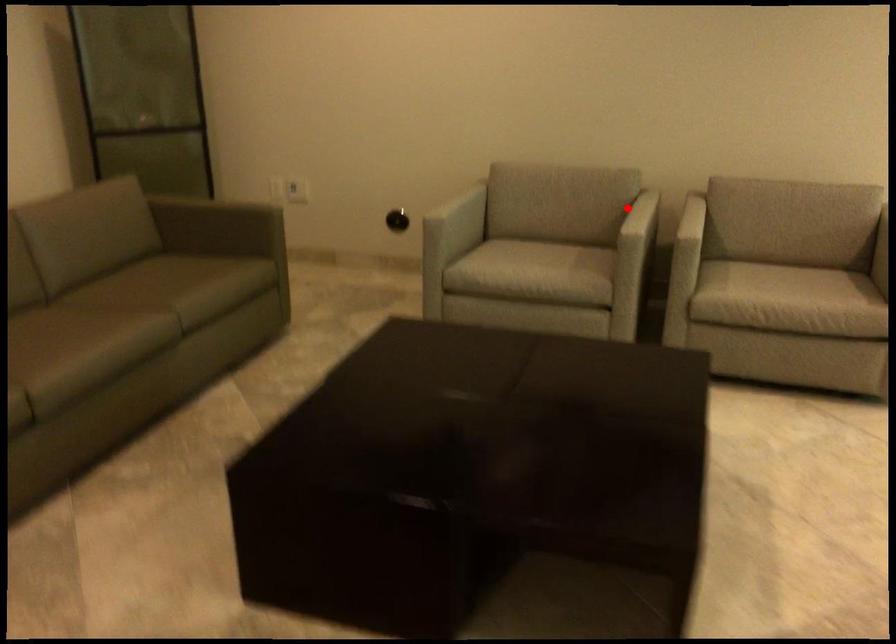
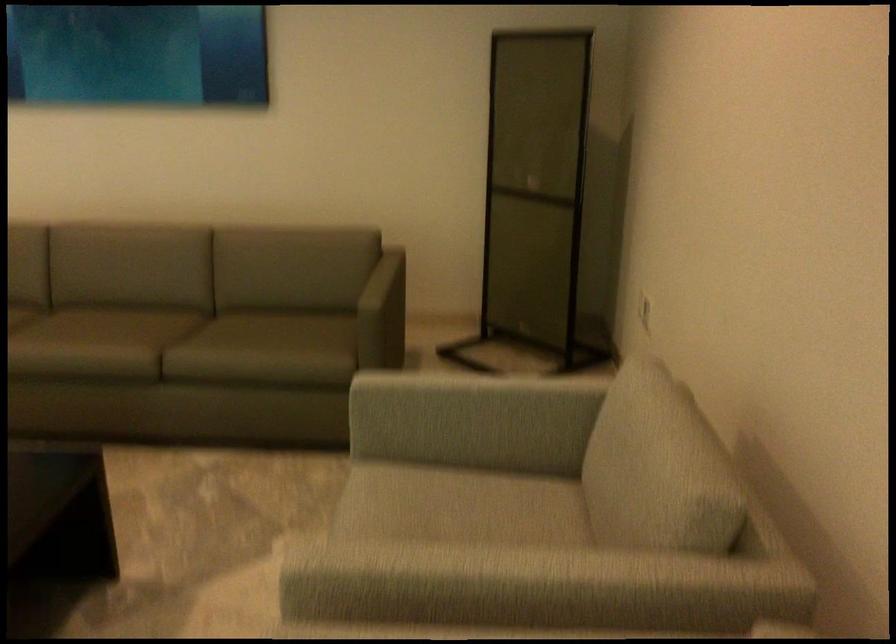
Locate, in the second image, the point that corresponds to the highlighted location in the first image.

(479, 573)